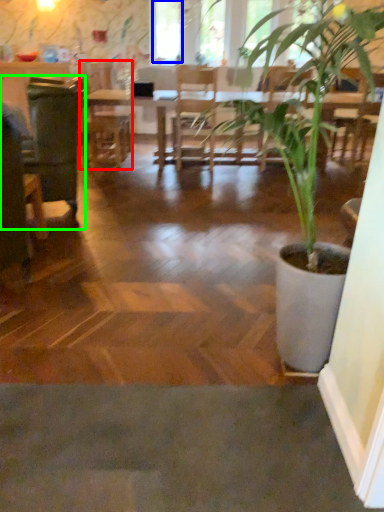
Question: Estimate the real-world distances between objects in this image. Which object is closer to armchair (highlighted by a red box), window screen (highlighted by a blue box) or swivel chair (highlighted by a green box)?

Choices:
 (A) window screen
 (B) swivel chair

Answer: (A)